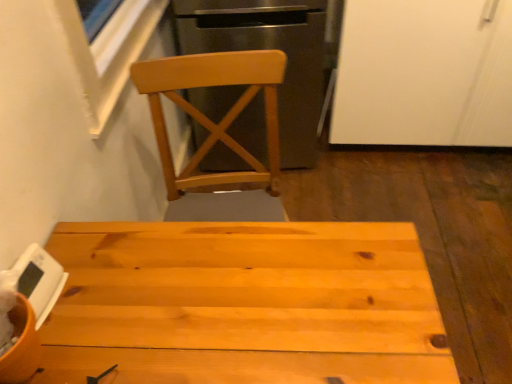
Question: Considering the relative sizes of light wood chair at upper center and white matte digital clock at lower left in the image provided, is light wood chair at upper center smaller than white matte digital clock at lower left?

Choices:
 (A) yes
 (B) no

Answer: (B)

Question: From a real-world perspective, does light wood chair at upper center stand above white matte digital clock at lower left?

Choices:
 (A) yes
 (B) no

Answer: (B)

Question: Does light wood chair at upper center appear on the right side of white matte digital clock at lower left?

Choices:
 (A) no
 (B) yes

Answer: (B)

Question: Is light wood chair at upper center placed right next to white matte digital clock at lower left?

Choices:
 (A) no
 (B) yes

Answer: (A)

Question: Is light wood chair at upper center shorter than white matte digital clock at lower left?

Choices:
 (A) no
 (B) yes

Answer: (A)

Question: Is the position of light wood chair at upper center less distant than that of white matte digital clock at lower left?

Choices:
 (A) yes
 (B) no

Answer: (B)

Question: Is white matte cabinet at upper right completely or partially inside natural wood table at center?

Choices:
 (A) yes
 (B) no

Answer: (B)

Question: Is natural wood table at center turned away from white matte cabinet at upper right?

Choices:
 (A) no
 (B) yes

Answer: (A)

Question: Is natural wood table at center positioned behind white matte cabinet at upper right?

Choices:
 (A) yes
 (B) no

Answer: (B)

Question: Can you confirm if natural wood table at center is smaller than white matte cabinet at upper right?

Choices:
 (A) yes
 (B) no

Answer: (A)

Question: Considering the relative sizes of natural wood table at center and white matte cabinet at upper right in the image provided, is natural wood table at center taller than white matte cabinet at upper right?

Choices:
 (A) yes
 (B) no

Answer: (B)

Question: Considering the relative positions of natural wood table at center and white matte cabinet at upper right in the image provided, is natural wood table at center to the left of white matte cabinet at upper right from the viewer's perspective?

Choices:
 (A) yes
 (B) no

Answer: (A)

Question: Can you confirm if light wood chair at upper center is thinner than white matte cabinet at upper right?

Choices:
 (A) yes
 (B) no

Answer: (A)